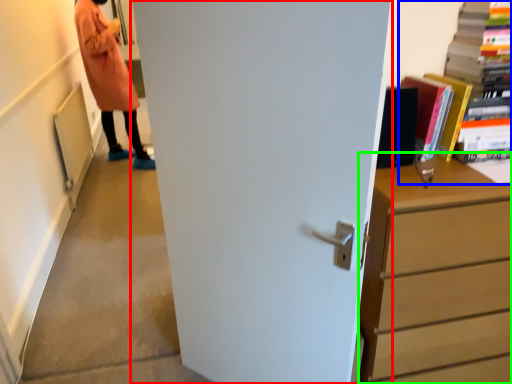
Question: Estimate the real-world distances between objects in this image. Which object is farther from door (highlighted by a red box), book (highlighted by a blue box) or chest of drawers (highlighted by a green box)?

Choices:
 (A) book
 (B) chest of drawers

Answer: (A)